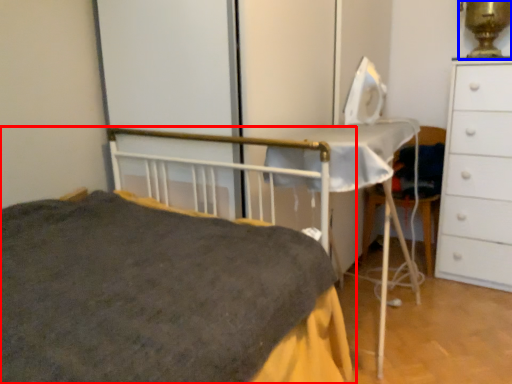
Question: Which object is further to the camera taking this photo, bed (highlighted by a red box) or table lamp (highlighted by a blue box)?

Choices:
 (A) bed
 (B) table lamp

Answer: (B)